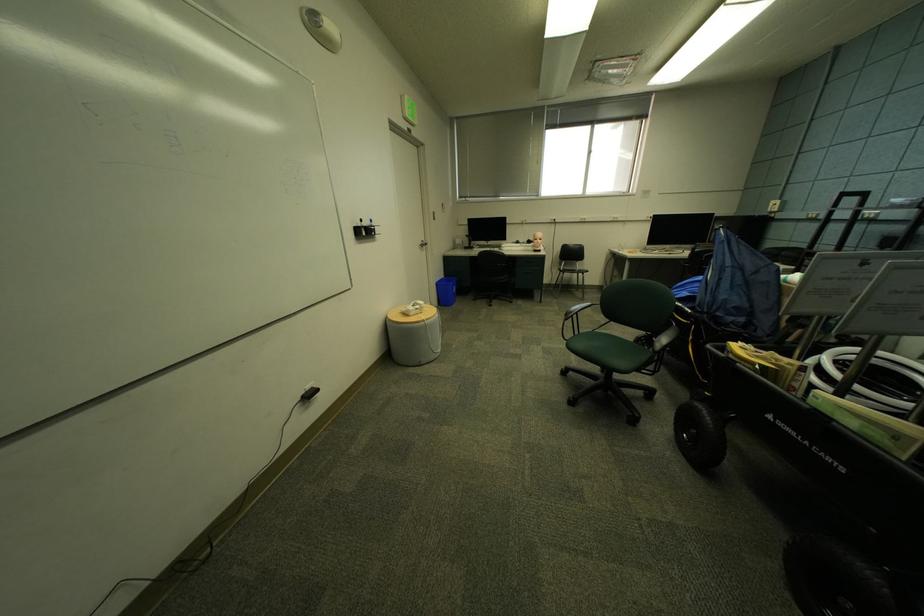
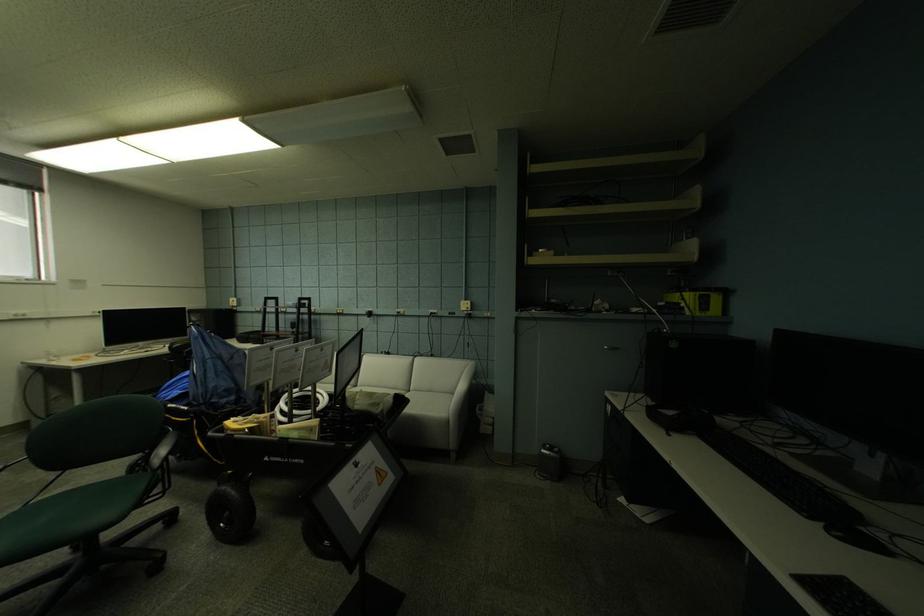
Question: The camera is either moving clockwise (left) or counter-clockwise (right) around the object. The first image is from the beginning of the video and the second image is from the end. Is the camera moving left or right when shooting the video?

Choices:
 (A) Left
 (B) Right

Answer: (A)